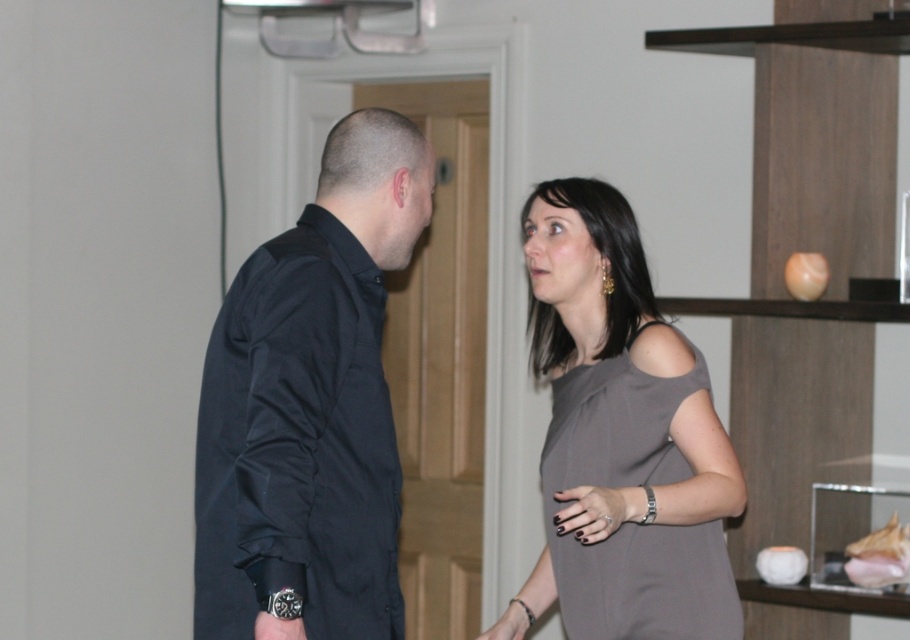
Does black matte shirt at left have a larger size compared to gray matte dress at center?

Correct, black matte shirt at left is larger in size than gray matte dress at center.

The image size is (910, 640). What are the coordinates of `black matte shirt at left` in the screenshot? It's located at (310, 406).

I want to click on black matte shirt at left, so click(310, 406).

Is black matte shirt at left to the left of black cotton shirt at left from the viewer's perspective?

Yes, black matte shirt at left is to the left of black cotton shirt at left.

Between black matte shirt at left and black cotton shirt at left, which one has less height?

Standing shorter between the two is black cotton shirt at left.

Locate an element on the screen. This screenshot has height=640, width=910. black matte shirt at left is located at coordinates (310, 406).

Does black cotton shirt at left have a greater height compared to gray matte dress at center?

Yes, black cotton shirt at left is taller than gray matte dress at center.

Describe the element at coordinates (310, 406) in the screenshot. The image size is (910, 640). I see `black cotton shirt at left` at that location.

The width and height of the screenshot is (910, 640). Find the location of `black cotton shirt at left`. black cotton shirt at left is located at coordinates tap(310, 406).